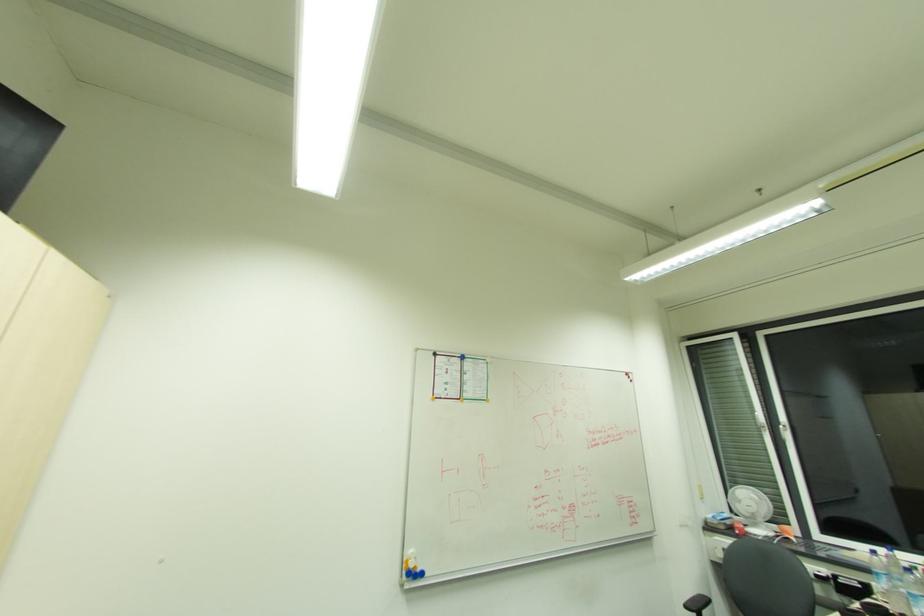
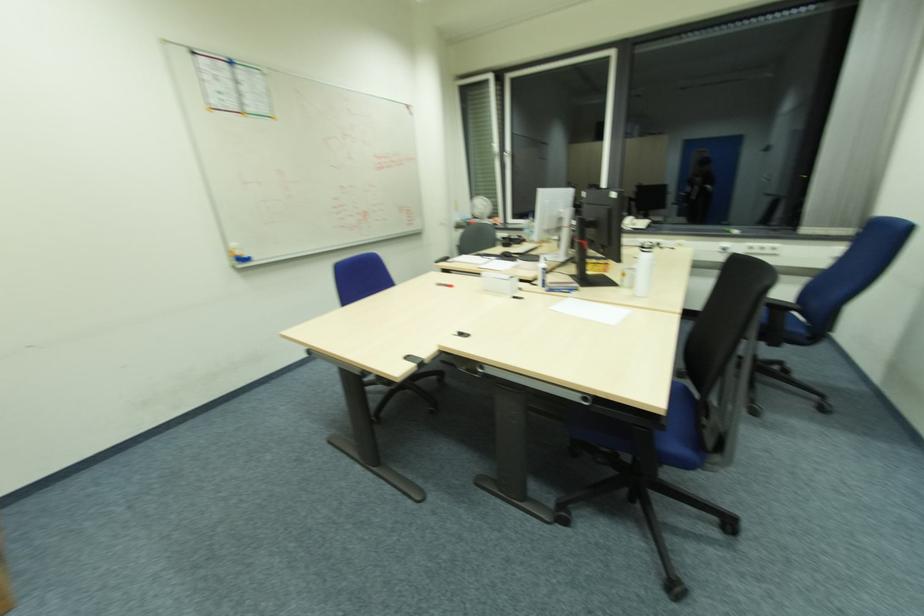
The first image is from the beginning of the video and the second image is from the end. How did the camera likely rotate when shooting the video?

The camera rotated toward right-down.